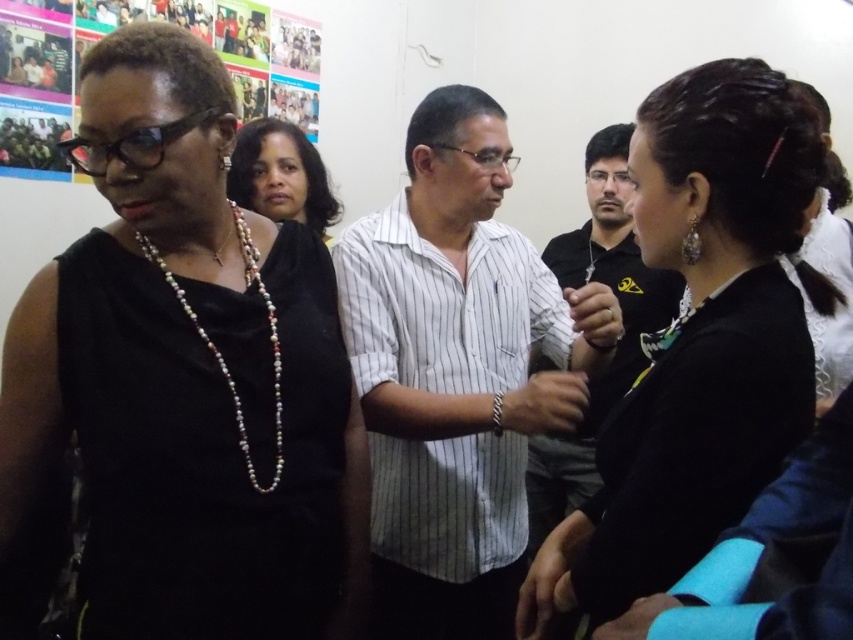
You are a photographer setting up for a group photo. You need to position the black matte dress at left and the white striped shirt at center so that they are exactly 14 inches apart. Based on their current positions, do you need to move them closer or farther apart?

The black matte dress at left is currently 12.22 inches from the white striped shirt at center. To reach the desired 14 inches, you need to move them farther apart by approximately 1.78 inches.

Based on the scene description, which object is shorter between the black fabric hair at center and the black striped shirt at center?

The black fabric hair at center is shorter than the black striped shirt at center according to the description.

Based on the photo, you are standing in the room where the conversation is happening. There are two points marked in the image. Which point, point (x=300, y=275) or point (x=254, y=161), is closer to you?

Point (x=300, y=275) is closer to the viewer than point (x=254, y=161).